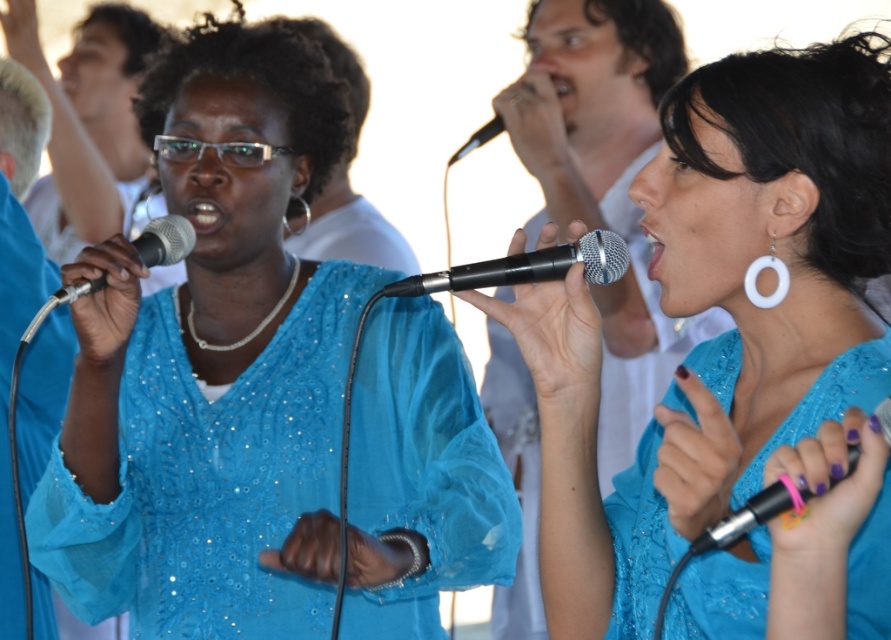
You are a photographer setting up for a live performance. You need to place a spotlight between the two points marked as point 1 and point 2. Which point should the spotlight be placed closer to so that it illuminates both performers equally? The points are located at coordinates point 1 at (154, 528) and point 2 at (137, 241). Please consider their positions relative to the camera.

The spotlight should be placed closer to point 2 at (137, 241) because point 1 at (154, 528) is further away from the camera. This ensures both points receive equal illumination as the light diminishes with distance.

In the scene shown: You are a photographer setting up for a live performance. You need to focus your camera on the matte blue blouse at center and the metallic silver microphone at center. Which object is taller in the image?

The matte blue blouse at center is much taller as metallic silver microphone at center.